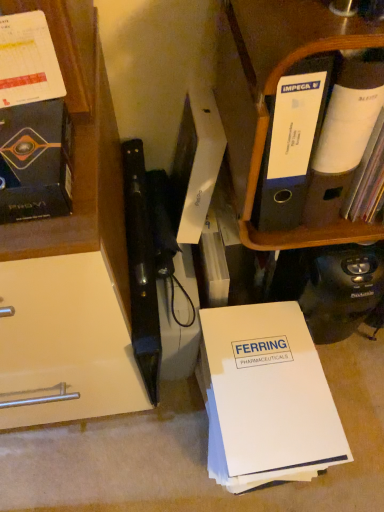
Question: Is white paper at center further to camera compared to black plastic folder at upper right?

Choices:
 (A) no
 (B) yes

Answer: (B)

Question: Is white paper at center oriented towards black plastic folder at upper right?

Choices:
 (A) yes
 (B) no

Answer: (B)

Question: Is black plastic folder at upper right at the back of white paper at center?

Choices:
 (A) yes
 (B) no

Answer: (B)

Question: Can you see white paper at center touching black plastic folder at upper right?

Choices:
 (A) yes
 (B) no

Answer: (B)

Question: Does white paper at center have a larger size compared to black plastic folder at upper right?

Choices:
 (A) yes
 (B) no

Answer: (A)

Question: Considering the positions of point (271, 472) and point (360, 234), is point (271, 472) closer or farther from the camera than point (360, 234)?

Choices:
 (A) closer
 (B) farther

Answer: (B)

Question: Considering the positions of white paper at center and black plastic folder at upper right in the image, is white paper at center wider or thinner than black plastic folder at upper right?

Choices:
 (A) wide
 (B) thin

Answer: (A)

Question: Choose the correct answer: Is white paper at center inside black plastic folder at upper right or outside it?

Choices:
 (A) outside
 (B) inside

Answer: (A)

Question: From the image's perspective, is white paper at center above or below black plastic folder at upper right?

Choices:
 (A) below
 (B) above

Answer: (A)

Question: Is black plastic folder at upper right wider or thinner than white paper at center?

Choices:
 (A) thin
 (B) wide

Answer: (A)

Question: Choose the correct answer: Is black plastic folder at upper right inside white paper at center or outside it?

Choices:
 (A) outside
 (B) inside

Answer: (A)

Question: Is black plastic folder at upper right to the left or to the right of white paper at center in the image?

Choices:
 (A) right
 (B) left

Answer: (A)

Question: Is point (297, 31) positioned closer to the camera than point (288, 464)?

Choices:
 (A) farther
 (B) closer

Answer: (B)

Question: From a real-world perspective, is matte black book at left above or below black plastic folder at upper right?

Choices:
 (A) below
 (B) above

Answer: (B)

Question: Relative to black plastic folder at upper right, is matte black book at left in front or behind?

Choices:
 (A) behind
 (B) front

Answer: (B)